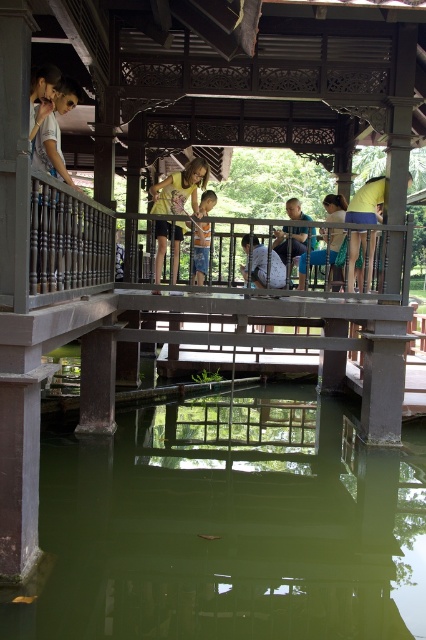
Looking at this image, you are standing on the deck of the pavilion looking out. You see a light brown fabric shirt at upper left and a light brown wooden child at center. Which object is closer to the water below?

The light brown wooden child at center is closer to the water below because the light brown fabric shirt at upper left is located above it.

You are standing on the wooden deck of the pavilion and see the green translucent water at center and the light blue denim shorts at center. Which object is positioned to the left?

The green translucent water at center is positioned to the left of the light blue denim shorts at center.

You are standing on the wooden deck of the pavilion and see a yellow fabric bag at center and blue denim shorts at center. Which item is taller?

The yellow fabric bag at center is taller than the blue denim shorts at center.